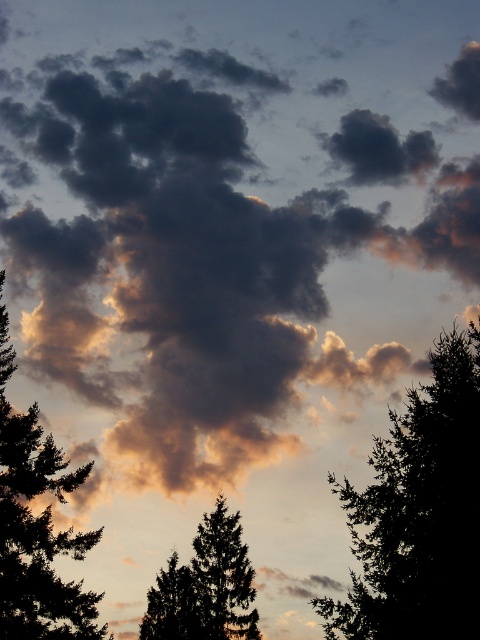
You are an astronomer observing the sky scene. You notice a point at coordinates (419, 513). What object does this point correspond to?

The point at coordinates (419, 513) corresponds to the silhouette tree at upper center.

You are an artist trying to paint the scene. You need to place the silhouette tree at upper center and the silhouette evergreen tree at left in your painting. According to the scene, which tree should you draw first to ensure proper positioning?

You should draw the silhouette evergreen tree at left first because the silhouette tree at upper center is positioned to the right of it, meaning the evergreen tree is closer to the left edge and needs to be placed before the upper center tree to maintain their spatial relationship.